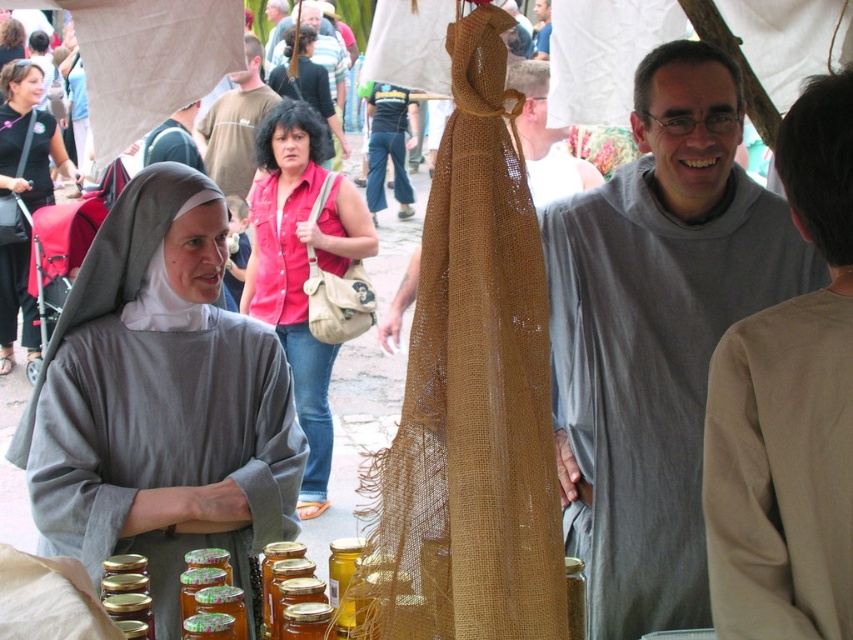
Question: Which point appears farthest from the camera in this image?

Choices:
 (A) (720, 269)
 (B) (22, 141)

Answer: (B)

Question: Which point is farther to the camera?

Choices:
 (A) (631, 115)
 (B) (537, 4)
 (C) (302, 246)
 (D) (15, 90)

Answer: (B)

Question: Which point is farther to the camera?

Choices:
 (A) matte gray robe at center
 (B) gray woolen robe at center
 (C) light brown leather jacket at upper center

Answer: (C)

Question: In this image, where is gray woolen robe at center located relative to matte gray robe at center?

Choices:
 (A) left
 (B) right

Answer: (B)

Question: Is burlap shawl at center positioned at the back of smooth blue shirt at center?

Choices:
 (A) no
 (B) yes

Answer: (A)

Question: Can you confirm if dark brown hair at center is smaller than light brown leather jacket at upper center?

Choices:
 (A) yes
 (B) no

Answer: (B)